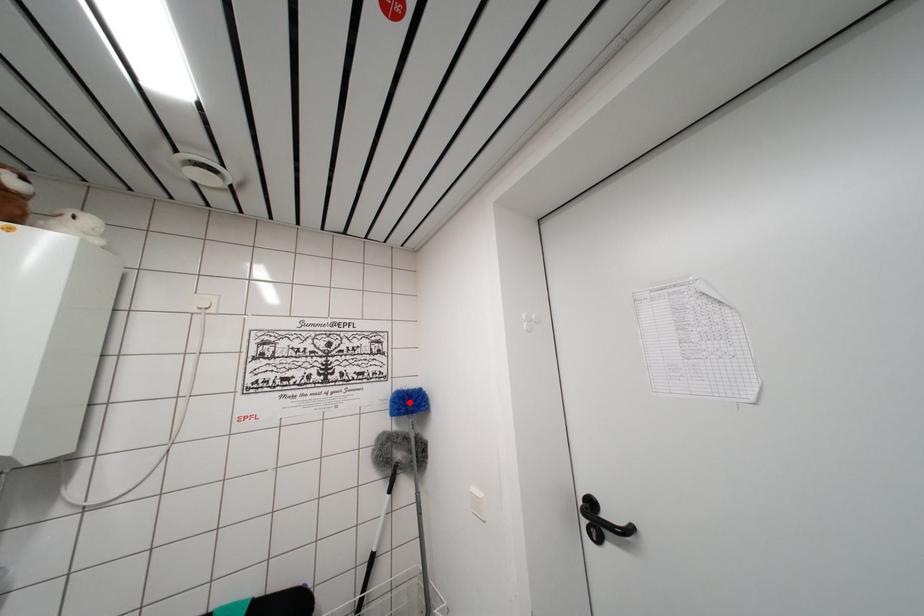
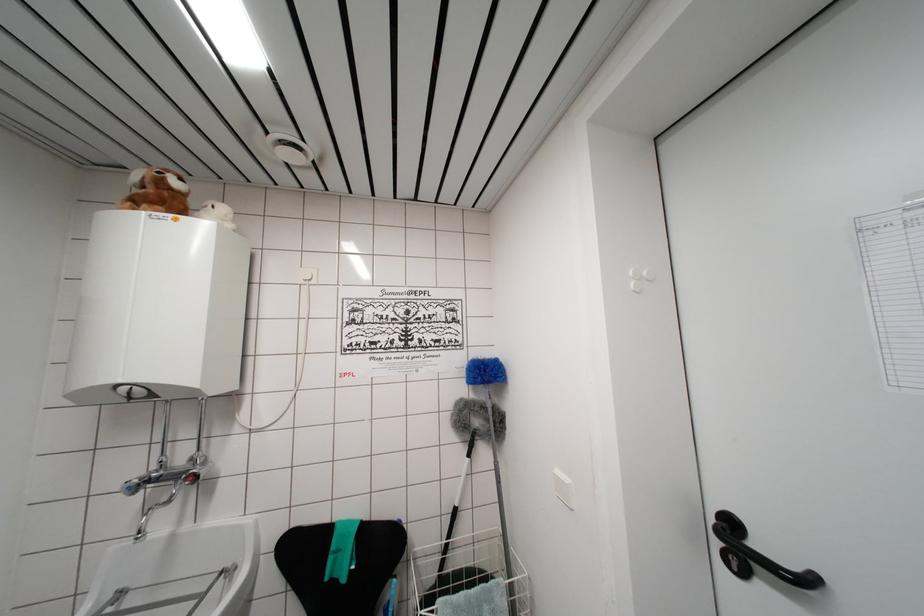
In the second image, find the point that corresponds to the highlighted location in the first image.

(484, 371)